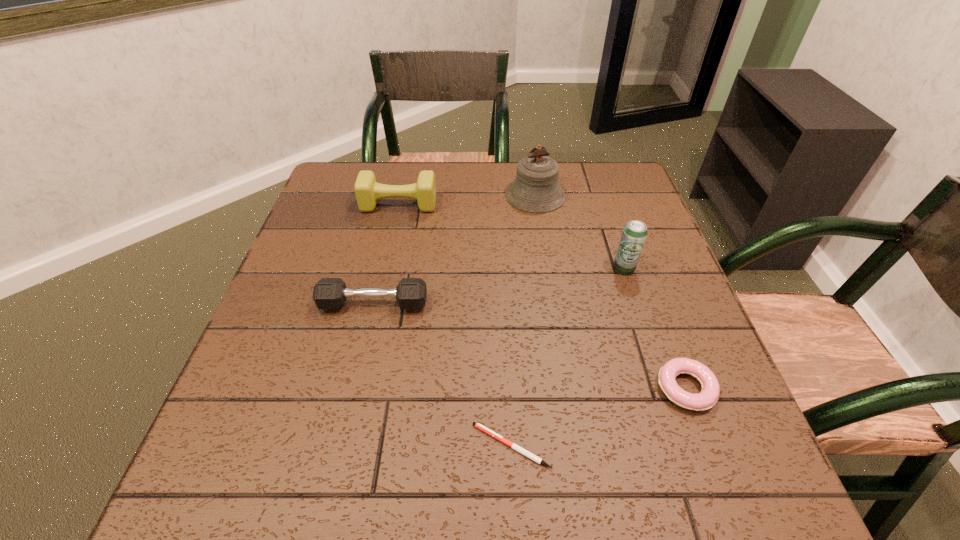
Locate an element on the screen. free space between the fifth farthest object and the tallest object is located at coordinates (611, 292).

This screenshot has height=540, width=960. What are the coordinates of `the closest object to the shortest object` in the screenshot? It's located at (707, 398).

Point out which object is positioned as the nearest to the pen. Please provide its 2D coordinates. Your answer should be formatted as a tuple, i.e. [(x, y)], where the tuple contains the x and y coordinates of a point satisfying the conditions above.

[(707, 398)]